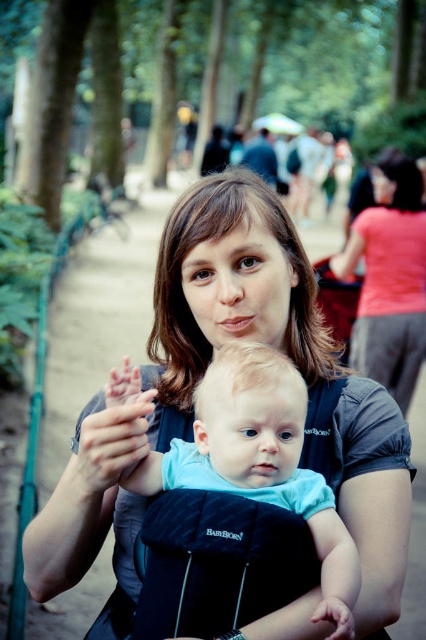
Does matte gray shirt at upper right appear under smooth skin hand at center?

Actually, matte gray shirt at upper right is above smooth skin hand at center.

Is matte gray shirt at upper right smaller than smooth skin hand at center?

No, matte gray shirt at upper right is not smaller than smooth skin hand at center.

Who is more forward, (397, 221) or (342, 618)?

Point (342, 618) is in front.

The width and height of the screenshot is (426, 640). Find the location of `matte gray shirt at upper right`. matte gray shirt at upper right is located at coordinates (389, 278).

Does matte gray shirt at center appear over matte skin hand at center?

Yes.

Does matte gray shirt at center appear on the left side of matte skin hand at center?

No, matte gray shirt at center is not to the left of matte skin hand at center.

Find the location of a particular element. This screenshot has height=640, width=426. matte gray shirt at center is located at coordinates (288, 355).

The height and width of the screenshot is (640, 426). What are the coordinates of `matte gray shirt at center` in the screenshot? It's located at (288, 355).

Is light blue fabric baby carrier at center to the left of matte skin hand at center from the viewer's perspective?

In fact, light blue fabric baby carrier at center is to the right of matte skin hand at center.

Who is more forward, (184, 460) or (141, 416)?

Point (184, 460) is more forward.

The height and width of the screenshot is (640, 426). What do you see at coordinates (256, 452) in the screenshot? I see `light blue fabric baby carrier at center` at bounding box center [256, 452].

The height and width of the screenshot is (640, 426). Identify the location of light blue fabric baby carrier at center. click(256, 452).